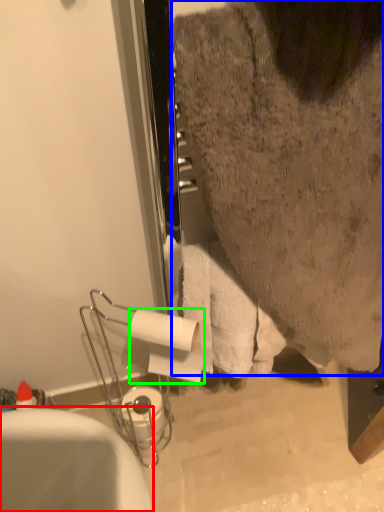
Question: Estimate the real-world distances between objects in this image. Which object is closer to bathtub (highlighted by a red box), person (highlighted by a blue box) or toilet paper (highlighted by a green box)?

Choices:
 (A) person
 (B) toilet paper

Answer: (B)